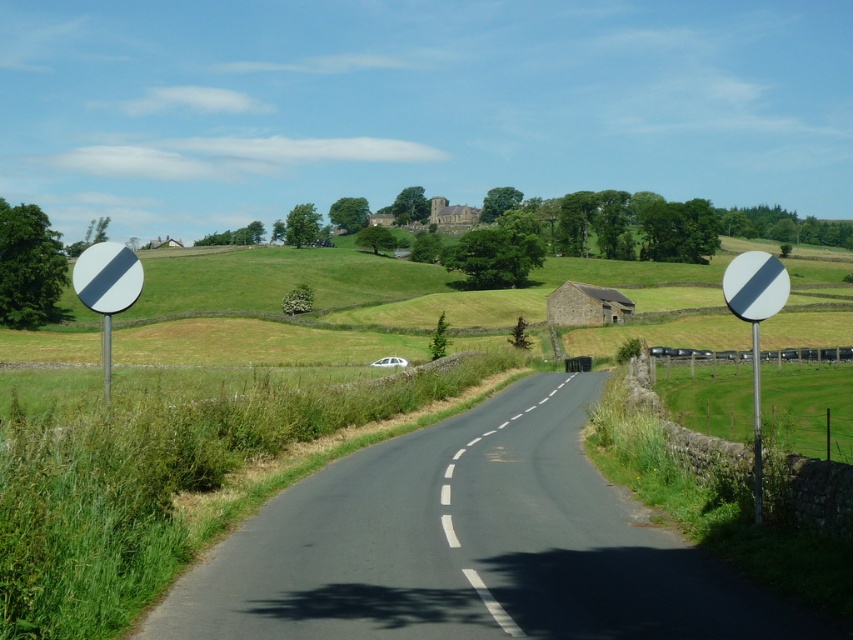
You are driving a car and see the white glossy circle at right and the white reflective circle at right on the road. Which one is closer to the road surface?

The white glossy circle at right is positioned under the white reflective circle at right, so it is closer to the road surface.

You are driving along the road and see two points marked on the map. The first point is at coordinates point (756, 387) and the second point is at point (733, 307). If you continue driving straight ahead, which point will you reach first?

Point (733, 307) will be reached first because it is in front of point (756, 387) along the road.